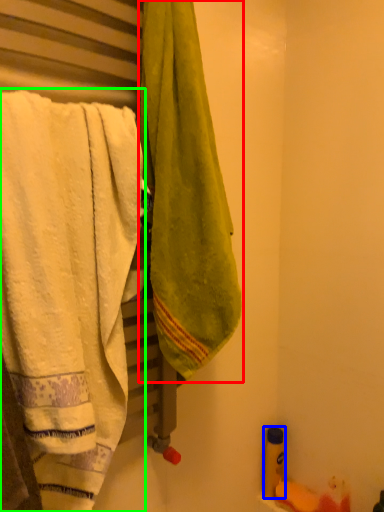
Question: Which object is the farthest from towel (highlighted by a red box)? Choose among these: toiletry (highlighted by a blue box) or towel (highlighted by a green box).

Choices:
 (A) toiletry
 (B) towel

Answer: (A)